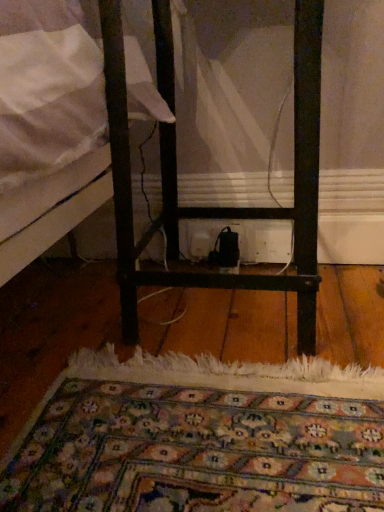
Question: In terms of width, does black metal nightstand at center look wider or thinner when compared to carpeted rug at center?

Choices:
 (A) thin
 (B) wide

Answer: (A)

Question: From the image's perspective, is black metal nightstand at center positioned above or below carpeted rug at center?

Choices:
 (A) above
 (B) below

Answer: (A)

Question: Estimate the real-world distances between objects in this image. Which object is farther from the carpeted rug at center?

Choices:
 (A) black metal nightstand at center
 (B) white plastic electric outlet at center

Answer: (B)

Question: Considering the real-world distances, which object is closest to the carpeted rug at center?

Choices:
 (A) black metal nightstand at center
 (B) white plastic electric outlet at center

Answer: (A)